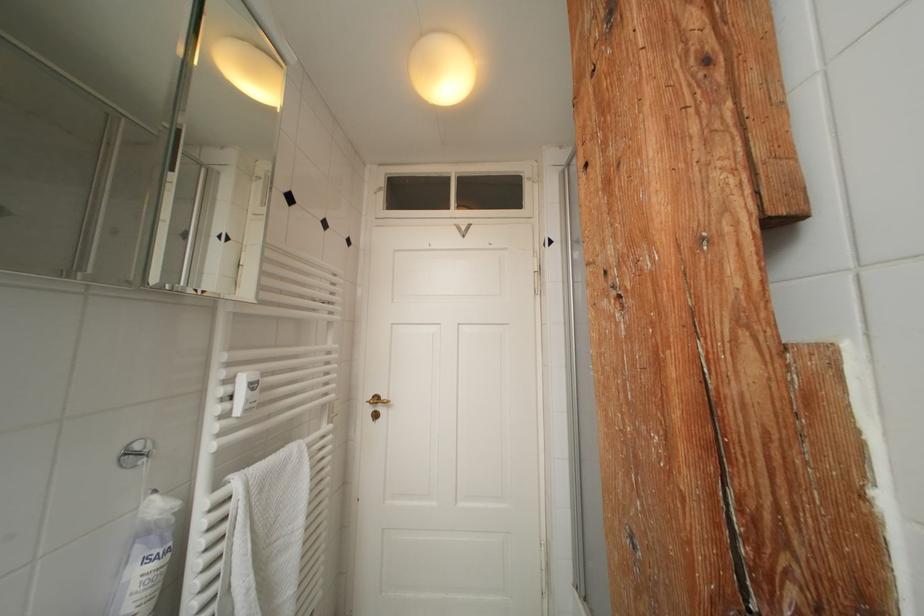
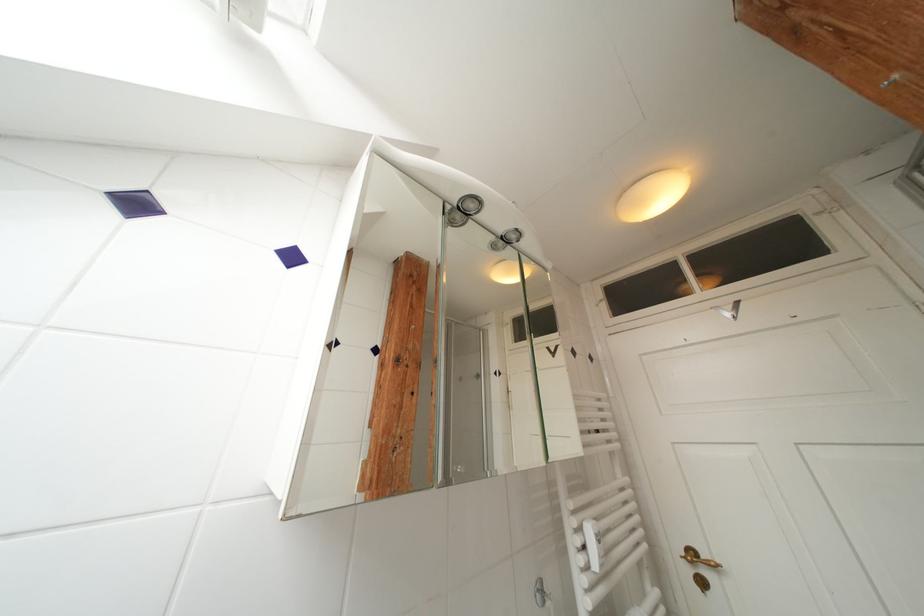
In the second image, find the point that corresponds to point (466, 231) in the first image.

(724, 312)